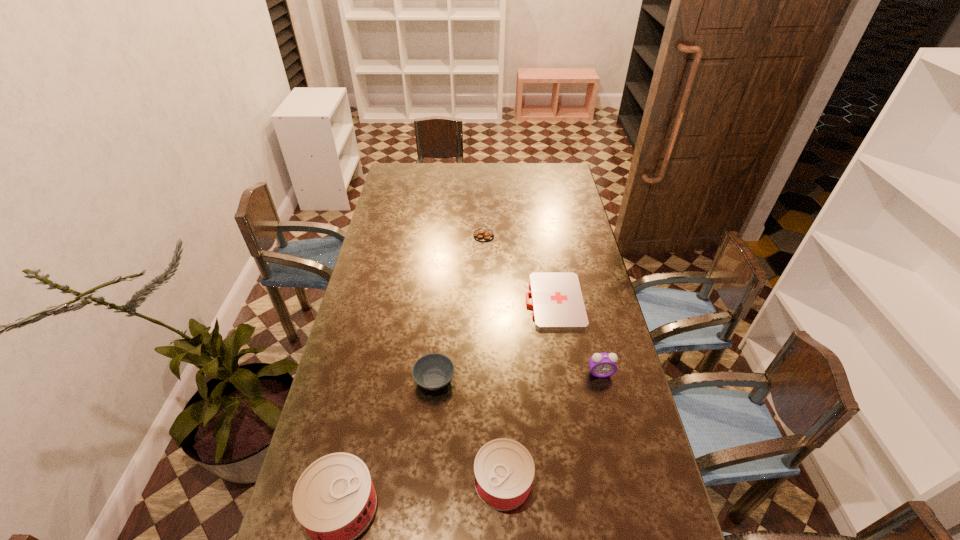
The width and height of the screenshot is (960, 540). Find the location of `vacant space at the left edge`. vacant space at the left edge is located at coordinates (377, 236).

You are a GUI agent. You are given a task and a screenshot of the screen. Output one action in this format:
    pyautogui.click(x=<x>, y=<y>)
    Task: Click on the free space at the right edge of the desktop
    This screenshot has height=540, width=960.
    Given the screenshot: What is the action you would take?
    pyautogui.click(x=622, y=375)

This screenshot has height=540, width=960. Find the location of `vacant region at the far left corner`. vacant region at the far left corner is located at coordinates (394, 169).

You are a GUI agent. You are given a task and a screenshot of the screen. Output one action in this format:
    pyautogui.click(x=<x>, y=<y>)
    Task: Click on the vacant space at the far right corner of the desktop
    
    Given the screenshot: What is the action you would take?
    pyautogui.click(x=564, y=174)

Identify the location of vacant space at the near right corner of the desktop. (637, 515).

Locate an element on the screen. The height and width of the screenshot is (540, 960). vacant point located between the right can and the farthest object is located at coordinates (493, 358).

Locate an element on the screen. vacant space in between the shortest object and the fourth tallest object is located at coordinates (494, 340).

What are the coordinates of `blank region between the alarm clock and the shorter can` in the screenshot? It's located at (552, 427).

Where is `unoccupied area between the shortest object and the right can`? The height and width of the screenshot is (540, 960). unoccupied area between the shortest object and the right can is located at coordinates (529, 391).

Find the location of a particular element. vacant area between the fifth nearest object and the shorter can is located at coordinates (529, 391).